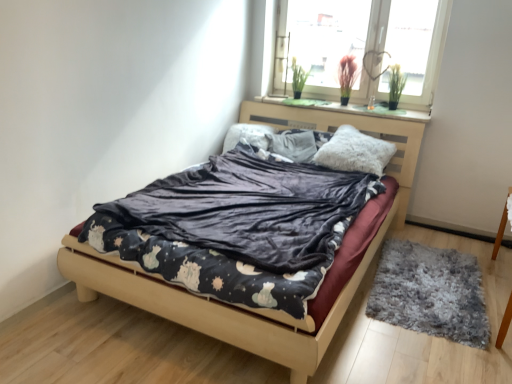
Describe the element at coordinates (246, 210) in the screenshot. I see `velvet dark blue blanket at center` at that location.

What do you see at coordinates (268, 309) in the screenshot? This screenshot has height=384, width=512. I see `velvet dark blue bed at center` at bounding box center [268, 309].

Where is `velvet dark blue bed at center`? velvet dark blue bed at center is located at coordinates (268, 309).

The width and height of the screenshot is (512, 384). Describe the element at coordinates (247, 136) in the screenshot. I see `fluffy white pillow at center, arranged as the third pillow when viewed from the right` at that location.

What do you see at coordinates (347, 108) in the screenshot? I see `green felt at upper center` at bounding box center [347, 108].

Image resolution: width=512 pixels, height=384 pixels. In order to click on fluffy white pillow at center, which is the 2th pillow in right-to-left order in this screenshot , I will do `click(293, 145)`.

Measure the distance between gray shaggy rug at lower right and camera.

gray shaggy rug at lower right is 2.20 meters from camera.

Measure the distance between point (322, 68) and camera.

A distance of 4.05 meters exists between point (322, 68) and camera.

Locate an element on the screen. The width and height of the screenshot is (512, 384). velvet dark blue blanket at center is located at coordinates (246, 210).

Consider the image. From a real-world perspective, is transparent glass window at upper center below green felt at upper center?

Actually, transparent glass window at upper center is physically above green felt at upper center in the real world.

Does transparent glass window at upper center appear on the left side of green felt at upper center?

Incorrect, transparent glass window at upper center is not on the left side of green felt at upper center.

From the image's perspective, is transparent glass window at upper center located beneath green felt at upper center?

No.

Is transparent glass window at upper center touching green felt at upper center?

No, transparent glass window at upper center is not with green felt at upper center.

How much distance is there between transparent glass window at upper center and white fluffy pillow at center, which appears as the 1th pillow when viewed from the right?

They are 32.37 inches apart.

Consider the image. Are transparent glass window at upper center and white fluffy pillow at center, which appears as the 1th pillow when viewed from the right, beside each other?

No, transparent glass window at upper center is not in contact with white fluffy pillow at center, which appears as the 1th pillow when viewed from the right.

Which of these two, transparent glass window at upper center or white fluffy pillow at center, the third pillow when ordered from left to right, is smaller?

white fluffy pillow at center, the third pillow when ordered from left to right.

Who is shorter, transparent glass window at upper center or white fluffy pillow at center, which appears as the 1th pillow when viewed from the right?

white fluffy pillow at center, which appears as the 1th pillow when viewed from the right, is shorter.

Which of these two, transparent glass window at upper center or velvet dark blue blanket at center, is smaller?

transparent glass window at upper center is smaller.

Is transparent glass window at upper center not near velvet dark blue blanket at center?

Yes, transparent glass window at upper center is far from velvet dark blue blanket at center.

Looking at this image, from the image's perspective, which one is positioned higher, transparent glass window at upper center or velvet dark blue blanket at center?

transparent glass window at upper center, from the image's perspective.

Locate an element on the screen. window above the velvet dark blue blanket at center (from the image's perspective) is located at coordinates pos(367,41).

Does velvet dark blue blanket at center have a lesser height compared to white fluffy pillow at center, which appears as the 1th pillow when viewed from the right?

Yes.

Considering the relative positions of velvet dark blue blanket at center and white fluffy pillow at center, which appears as the 1th pillow when viewed from the right, in the image provided, is velvet dark blue blanket at center to the left of white fluffy pillow at center, which appears as the 1th pillow when viewed from the right, from the viewer's perspective?

Correct, you'll find velvet dark blue blanket at center to the left of white fluffy pillow at center, which appears as the 1th pillow when viewed from the right.

Could you measure the distance between velvet dark blue blanket at center and white fluffy pillow at center, the third pillow when ordered from left to right?

velvet dark blue blanket at center and white fluffy pillow at center, the third pillow when ordered from left to right, are 26.63 inches apart from each other.

Which object is further away from the camera, velvet dark blue blanket at center or white fluffy pillow at center, which appears as the 1th pillow when viewed from the right?

white fluffy pillow at center, which appears as the 1th pillow when viewed from the right.

The height and width of the screenshot is (384, 512). What are the coordinates of `mat below the white fluffy pillow at center, the third pillow when ordered from left to right (from a real-world perspective)` in the screenshot? It's located at (430, 292).

From a real-world perspective, relative to gray shaggy rug at lower right, is white fluffy pillow at center, the third pillow when ordered from left to right, vertically above or below?

From a real-world perspective, white fluffy pillow at center, the third pillow when ordered from left to right, is physically above gray shaggy rug at lower right.

Is white fluffy pillow at center, which appears as the 1th pillow when viewed from the right, beside gray shaggy rug at lower right?

They are not placed beside each other.

Considering the positions of objects transparent glass window at upper center and fluffy white pillow at center, the second pillow from the left, in the image provided, who is more to the right, transparent glass window at upper center or fluffy white pillow at center, the second pillow from the left,?

Positioned to the right is transparent glass window at upper center.

Which point is more distant from viewer, (410, 88) or (283, 131)?

Point (283, 131)

Which of these two, transparent glass window at upper center or fluffy white pillow at center, the second pillow from the left, is wider?

With larger width is fluffy white pillow at center, the second pillow from the left.

Does transparent glass window at upper center turn towards fluffy white pillow at center, the second pillow from the left?

No, transparent glass window at upper center is not facing towards fluffy white pillow at center, the second pillow from the left.

Considering the sizes of velvet dark blue blanket at center and transparent glass window at upper center in the image, is velvet dark blue blanket at center wider or thinner than transparent glass window at upper center?

Clearly, velvet dark blue blanket at center has more width compared to transparent glass window at upper center.

In the scene shown: Is velvet dark blue blanket at center far from transparent glass window at upper center?

That's right, there is a large distance between velvet dark blue blanket at center and transparent glass window at upper center.

Which is farther from the camera, (298, 188) or (369, 87)?

The point (369, 87) is more distant.

How different are the orientations of velvet dark blue blanket at center and transparent glass window at upper center in degrees?

The angular difference between velvet dark blue blanket at center and transparent glass window at upper center is 0.209 degrees.

Where is `window sill behind the transparent glass window at upper center`? window sill behind the transparent glass window at upper center is located at coordinates (347, 108).

At what (x,y) coordinates should I click in order to perform the action: click on pillow that is the 1st one below the transparent glass window at upper center (from a real-world perspective). Please return your answer as a coordinate pair (x, y). Looking at the image, I should click on [x=355, y=152].

Based on their spatial positions, is velvet dark blue blanket at center or transparent glass window at upper center further from gray shaggy rug at lower right?

Among the two, transparent glass window at upper center is located further to gray shaggy rug at lower right.

Based on their spatial positions, is fluffy white pillow at center, which is the 2th pillow in right-to-left order, or green felt at upper center further from velvet dark blue bed at center?

green felt at upper center.

Which object lies further to the anchor point fluffy white pillow at center, which is the 2th pillow in right-to-left order, white fluffy pillow at center, the third pillow when ordered from left to right, or gray shaggy rug at lower right?

gray shaggy rug at lower right is further to fluffy white pillow at center, which is the 2th pillow in right-to-left order.

Looking at the image, which one is located closer to gray shaggy rug at lower right, fluffy white pillow at center, the second pillow from the left, or velvet dark blue blanket at center?

velvet dark blue blanket at center.

When comparing their distances from white fluffy pillow at center, which appears as the 1th pillow when viewed from the right, does fluffy white pillow at center, arranged as the third pillow when viewed from the right, or velvet dark blue blanket at center seem further?

The object further to white fluffy pillow at center, which appears as the 1th pillow when viewed from the right, is fluffy white pillow at center, arranged as the third pillow when viewed from the right.

Estimate the real-world distances between objects in this image. Which object is closer to velvet dark blue bed at center, velvet dark blue blanket at center or transparent glass window at upper center?

velvet dark blue blanket at center is positioned closer to the anchor velvet dark blue bed at center.

Looking at the image, which one is located closer to white fluffy pillow at center, the third pillow when ordered from left to right, gray shaggy rug at lower right or transparent glass window at upper center?

transparent glass window at upper center.

Based on their spatial positions, is transparent glass window at upper center or velvet dark blue blanket at center closer to velvet dark blue bed at center?

velvet dark blue blanket at center is closer to velvet dark blue bed at center.

Identify the location of blanket positioned between velvet dark blue bed at center and green felt at upper center from near to far. Image resolution: width=512 pixels, height=384 pixels. (246, 210).

Where is `pillow between fluffy white pillow at center, the 1th pillow viewed from the left, and white fluffy pillow at center, which appears as the 1th pillow when viewed from the right, in the horizontal direction`? The image size is (512, 384). pillow between fluffy white pillow at center, the 1th pillow viewed from the left, and white fluffy pillow at center, which appears as the 1th pillow when viewed from the right, in the horizontal direction is located at coordinates (293, 145).

Where is `pillow between velvet dark blue blanket at center and green felt at upper center along the z-axis`? The height and width of the screenshot is (384, 512). pillow between velvet dark blue blanket at center and green felt at upper center along the z-axis is located at coordinates (355, 152).

The width and height of the screenshot is (512, 384). Find the location of `pillow between velvet dark blue bed at center and transparent glass window at upper center along the z-axis`. pillow between velvet dark blue bed at center and transparent glass window at upper center along the z-axis is located at coordinates (355, 152).